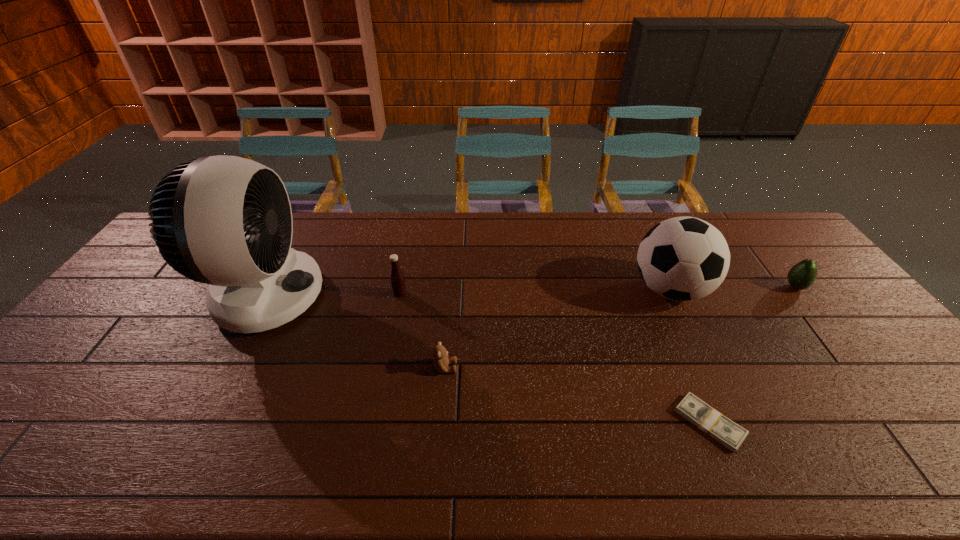
This screenshot has width=960, height=540. In the image, there is a desktop. In order to click on free space at the near edge in this screenshot , I will do `click(497, 448)`.

At what (x,y) coordinates should I click in order to perform the action: click on free space at the left edge of the desktop. Please return your answer as a coordinate pair (x, y). Looking at the image, I should click on (135, 321).

This screenshot has width=960, height=540. In the image, there is a desktop. Find the location of `vacant space at the right edge`. vacant space at the right edge is located at coordinates click(x=893, y=412).

Locate an element on the screen. The image size is (960, 540). vacant area at the near left corner of the desktop is located at coordinates (35, 450).

Where is `free space between the leftmost object and the avocado`? The width and height of the screenshot is (960, 540). free space between the leftmost object and the avocado is located at coordinates (530, 292).

The height and width of the screenshot is (540, 960). I want to click on free area in between the dollar and the second tallest object, so click(690, 356).

I want to click on vacant area that lies between the rightmost object and the shortest object, so click(753, 355).

Identify the location of free space between the fan and the soccer ball. (468, 293).

Find the location of a particular element. This screenshot has width=960, height=540. free space between the rightmost object and the Tabasco sauce is located at coordinates (597, 291).

Find the location of a particular element. This screenshot has height=540, width=960. vacant area between the tallest object and the teddy bear is located at coordinates (354, 332).